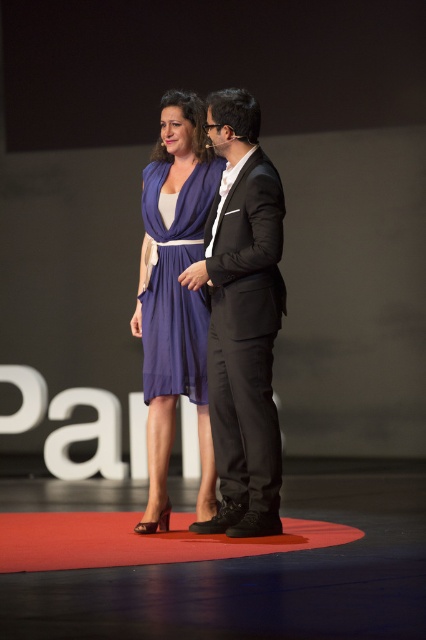
Question: Which point is closer to the camera?

Choices:
 (A) matte purple dress at center
 (B) black satin suit at center
 (C) satin purple dress at center
 (D) red carpet at center

Answer: (D)

Question: Is matte purple dress at center smaller than satin purple dress at center?

Choices:
 (A) no
 (B) yes

Answer: (A)

Question: Which is nearer to the matte purple dress at center?

Choices:
 (A) black satin suit at center
 (B) satin purple dress at center

Answer: (B)

Question: Among these points, which one is farthest from the camera?

Choices:
 (A) (154, 276)
 (B) (157, 346)

Answer: (A)

Question: Observing the image, what is the correct spatial positioning of red carpet at center in reference to satin purple dress at center?

Choices:
 (A) right
 (B) left

Answer: (B)

Question: Can you confirm if black satin suit at center is positioned below matte purple dress at center?

Choices:
 (A) yes
 (B) no

Answer: (A)